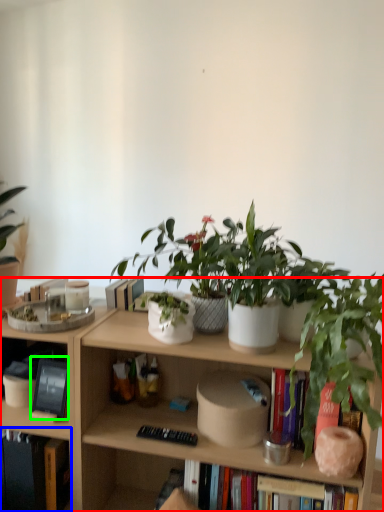
Question: Which object is positioned farthest from bookcase (highlighted by a red box)? Select from book (highlighted by a blue box) and book (highlighted by a green box).

Choices:
 (A) book
 (B) book

Answer: (B)